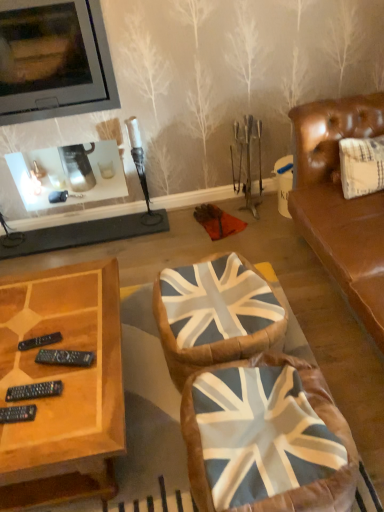
Question: Do you think union jack fabric swivel chair at center, the second swivel chair when ordered from front to back, is within union jack fabric swivel chair at center, which appears as the 2th swivel chair when viewed from the back, or outside of it?

Choices:
 (A) inside
 (B) outside

Answer: (B)

Question: From a real-world perspective, is union jack fabric swivel chair at center, the 1th swivel chair when ordered from back to front, positioned above or below union jack fabric swivel chair at center, which appears as the 2th swivel chair when viewed from the back?

Choices:
 (A) below
 (B) above

Answer: (A)

Question: Estimate the real-world distances between objects in this image. Which object is closer to the union jack fabric swivel chair at center, the 1th swivel chair when ordered from back to front?

Choices:
 (A) woodenwoodencoffee table at lower left
 (B) union jack fabric swivel chair at center, the 1th swivel chair positioned from the front
 (C) matte black television at upper left

Answer: (B)

Question: Which of these objects is positioned closest to the matte black television at upper left?

Choices:
 (A) union jack fabric swivel chair at center, the 1th swivel chair when ordered from back to front
 (B) woodenwoodencoffee table at lower left
 (C) union jack fabric swivel chair at center, the 1th swivel chair positioned from the front

Answer: (B)